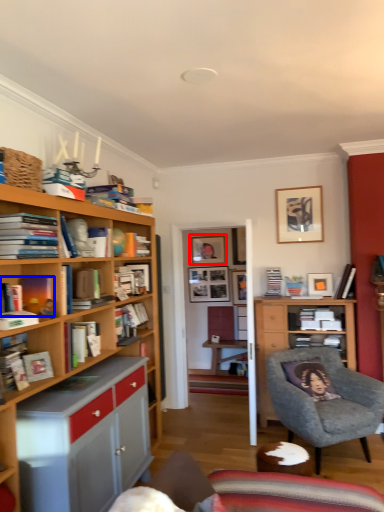
Question: Among these objects, which one is farthest to the camera, picture frame (highlighted by a red box) or book (highlighted by a blue box)?

Choices:
 (A) picture frame
 (B) book

Answer: (A)